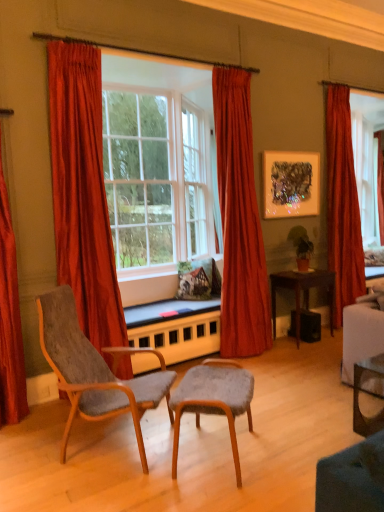
At what (x,y) coordinates should I click in order to perform the action: click on free space underneath textured gray fabric chair at lower left, marked as the 2th chair in a right-to-left arrangement (from a real-world perspective). Please return your answer as a coordinate pair (x, y). This screenshot has width=384, height=512. Looking at the image, I should click on (102, 448).